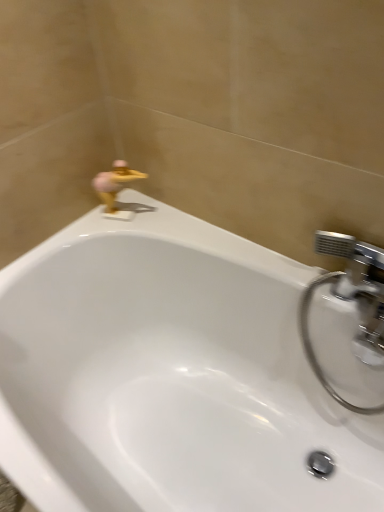
Question: Is chrome metallic faucet at upper right bigger than gold metallic duck at upper left?

Choices:
 (A) no
 (B) yes

Answer: (B)

Question: Is chrome metallic faucet at upper right not within gold metallic duck at upper left?

Choices:
 (A) no
 (B) yes

Answer: (B)

Question: From a real-world perspective, is chrome metallic faucet at upper right on top of gold metallic duck at upper left?

Choices:
 (A) no
 (B) yes

Answer: (A)

Question: Is gold metallic duck at upper left located within chrome metallic faucet at upper right?

Choices:
 (A) yes
 (B) no

Answer: (B)

Question: Is chrome metallic faucet at upper right shorter than gold metallic duck at upper left?

Choices:
 (A) yes
 (B) no

Answer: (B)

Question: Considering their positions, is white glossy bathtub at upper center located in front of or behind chrome metallic faucet at upper right?

Choices:
 (A) behind
 (B) front

Answer: (B)

Question: Does point (279, 270) appear closer or farther from the camera than point (382, 261)?

Choices:
 (A) farther
 (B) closer

Answer: (A)

Question: From the image's perspective, relative to chrome metallic faucet at upper right, is white glossy bathtub at upper center above or below?

Choices:
 (A) above
 (B) below

Answer: (B)

Question: Would you say white glossy bathtub at upper center is to the left or to the right of chrome metallic faucet at upper right in the picture?

Choices:
 (A) left
 (B) right

Answer: (A)

Question: Does point (334, 279) appear closer or farther from the camera than point (263, 304)?

Choices:
 (A) farther
 (B) closer

Answer: (B)

Question: From the image's perspective, relative to white glossy bathtub at upper center, is chrome metallic faucet at upper right above or below?

Choices:
 (A) above
 (B) below

Answer: (A)

Question: In terms of width, does chrome metallic faucet at upper right look wider or thinner when compared to white glossy bathtub at upper center?

Choices:
 (A) thin
 (B) wide

Answer: (A)

Question: Based on their positions, is chrome metallic faucet at upper right located to the left or right of white glossy bathtub at upper center?

Choices:
 (A) left
 (B) right

Answer: (B)

Question: Looking at the image, does gold metallic duck at upper left seem bigger or smaller compared to chrome metallic faucet at upper right?

Choices:
 (A) small
 (B) big

Answer: (A)

Question: Considering the relative positions of gold metallic duck at upper left and chrome metallic faucet at upper right in the image provided, is gold metallic duck at upper left to the left or to the right of chrome metallic faucet at upper right?

Choices:
 (A) left
 (B) right

Answer: (A)